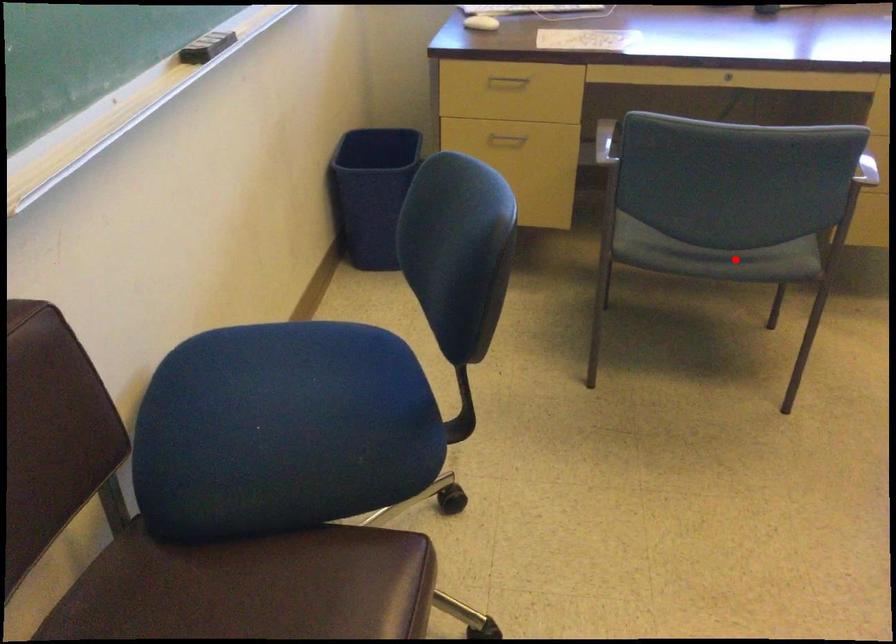
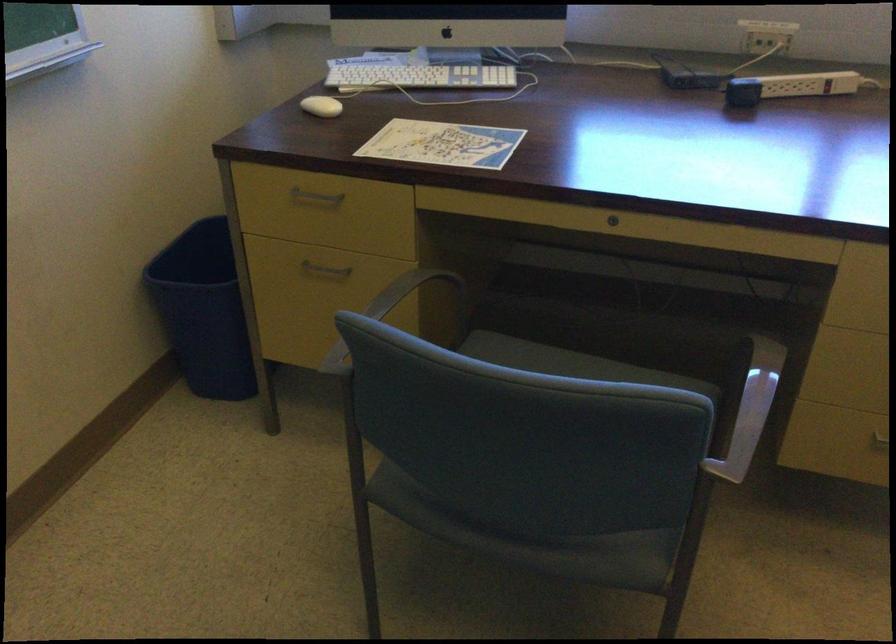
In the second image, find the point that corresponds to the highlighted location in the first image.

(538, 542)